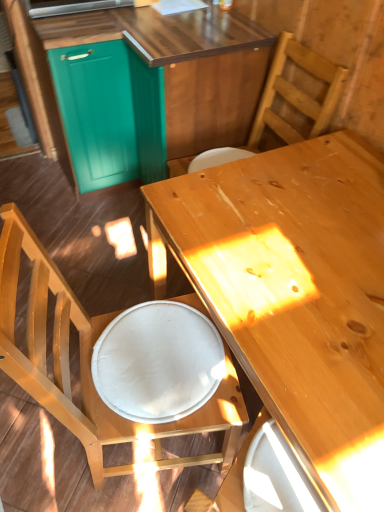
Question: From the image's perspective, relative to light brown wood desk at center, is teal wood cabinetry at upper left above or below?

Choices:
 (A) below
 (B) above

Answer: (B)

Question: Looking at their shapes, would you say teal wood cabinetry at upper left is wider or thinner than light brown wood desk at center?

Choices:
 (A) thin
 (B) wide

Answer: (B)

Question: Which object is the farthest from the light brown wood desk at center?

Choices:
 (A) teal wood cabinetry at upper left
 (B) wooden chair at upper right, which is the 1th chair in top-to-bottom order
 (C) wooden chair at lower left, which appears as the first chair when ordered from the bottom
 (D) white fabric plate at lower center

Answer: (A)

Question: Which is nearer to the light brown wood desk at center?

Choices:
 (A) teal wood cabinetry at upper left
 (B) white fabric plate at lower center
 (C) wooden chair at lower left, which appears as the 2th chair when viewed from the top
 (D) wooden chair at upper right, which is the second chair in bottom-to-top order

Answer: (B)